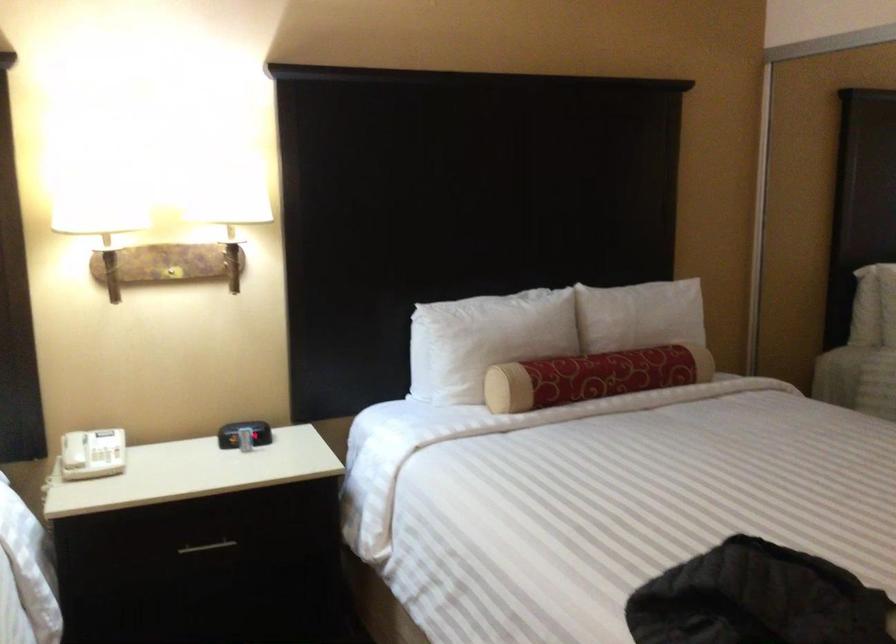
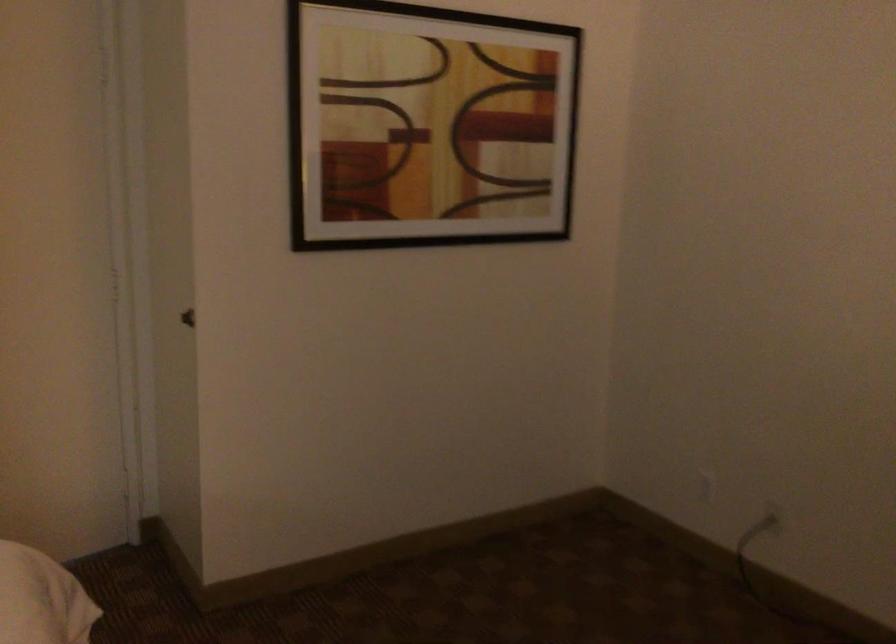
Question: The images are taken continuously from a first-person perspective. In which direction is your viewpoint rotating?

Choices:
 (A) Left
 (B) Right
 (C) Up
 (D) Down

Answer: (B)